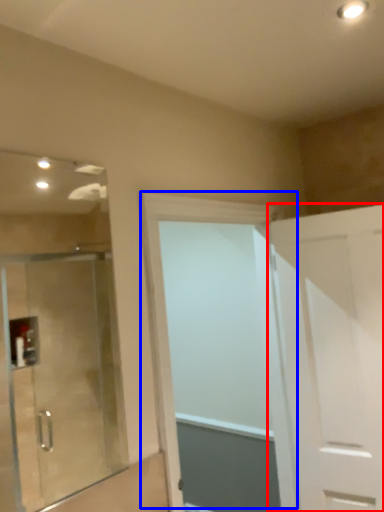
Question: Which object is closer to the camera taking this photo, door (highlighted by a red box) or door (highlighted by a blue box)?

Choices:
 (A) door
 (B) door

Answer: (B)